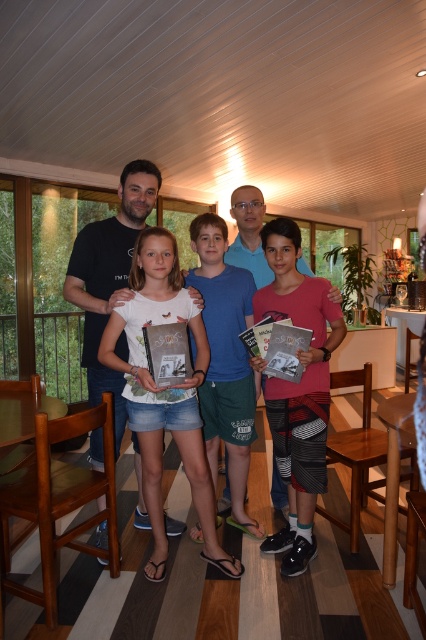
In the image of the family in the modern living space, there is a point at coordinates (298, 388). Which object from the list below is located at that point? Choose from the following options. A. The denim shorts and white t shirt. B. The blue t shirt and green shorts. C. The red t shirt and patterned. D. The pink matte shirt at center.

The point at coordinates (298, 388) is located on the pink matte shirt at center, so the correct answer is D.